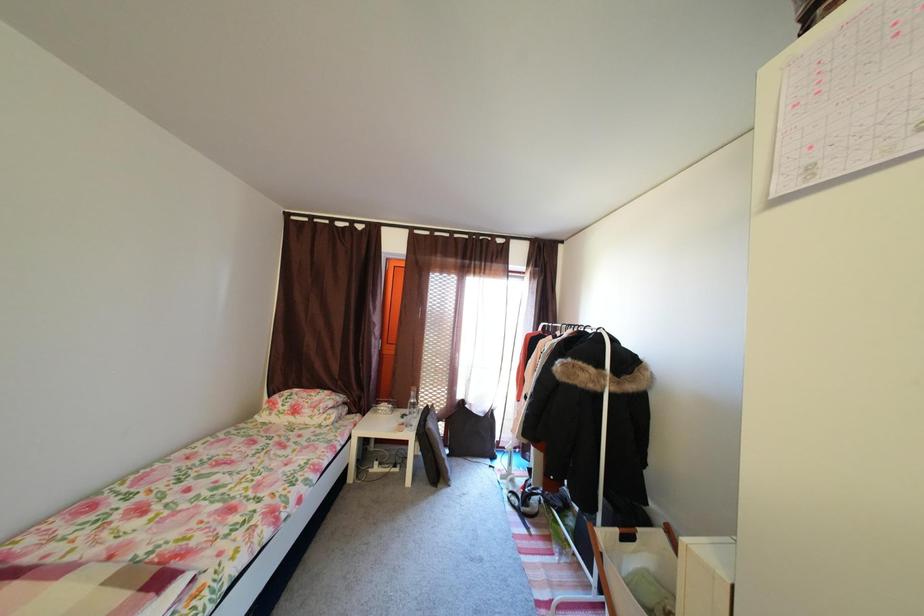
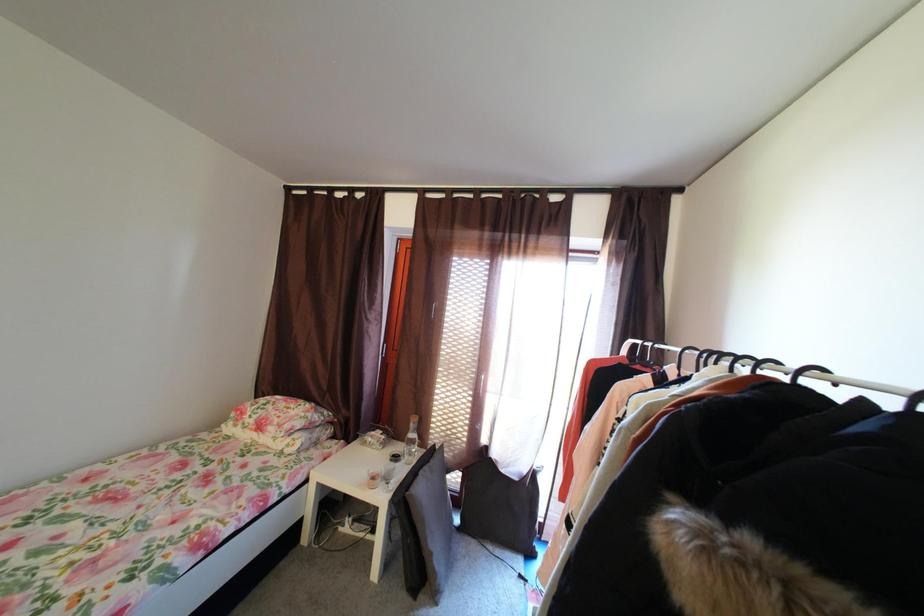
In a continuous first-person perspective shot, in which direction is the camera moving?

The cameraman walked toward right, forward.